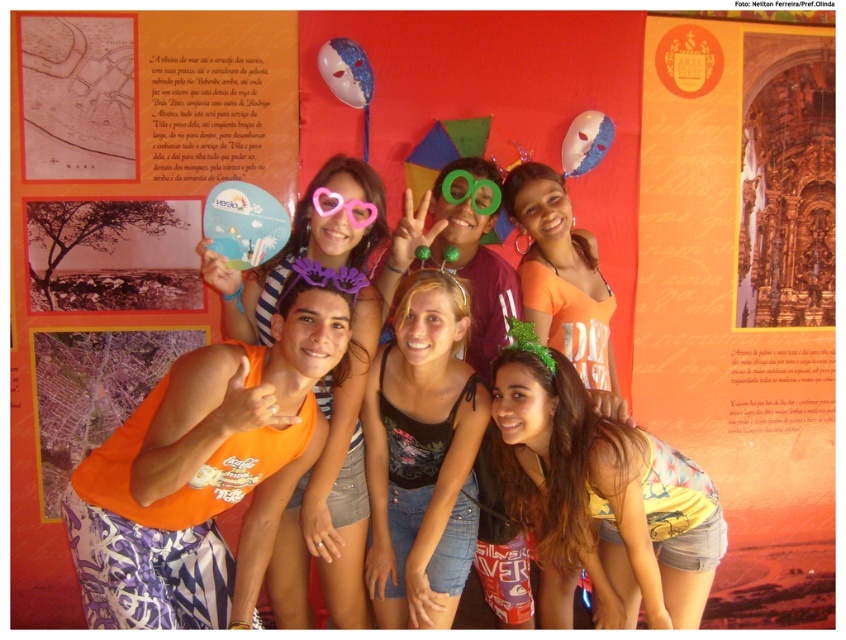
Question: Which object is farther from the camera taking this photo?

Choices:
 (A) denim shorts at center
 (B) orange fabric tank top at center
 (C) orange fabric at center

Answer: (A)

Question: Which object appears closest to the camera in this image?

Choices:
 (A) orange fabric at center
 (B) pink plastic heart-shaped goggles at center
 (C) denim shorts at center
 (D) yellow printed tank top at lower center

Answer: (A)

Question: Can you confirm if yellow printed tank top at lower center is wider than pink plastic heart-shaped goggles at center?

Choices:
 (A) yes
 (B) no

Answer: (A)

Question: Which object is farther from the camera taking this photo?

Choices:
 (A) green plastic goggles at center
 (B) orange fabric tank top at center
 (C) denim shorts at center

Answer: (A)

Question: In this image, where is denim shorts at center located relative to green plastic goggles at center?

Choices:
 (A) above
 (B) below

Answer: (B)

Question: Is orange cotton tank top at center wider than pink plastic heart-shaped goggles at center?

Choices:
 (A) yes
 (B) no

Answer: (A)